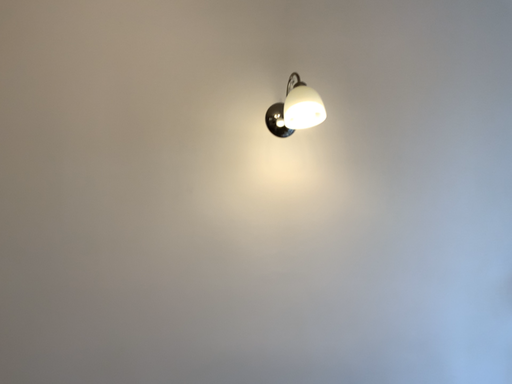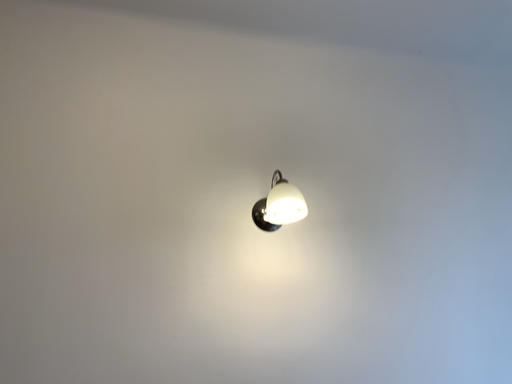
Question: Which way did the camera rotate in the video?

Choices:
 (A) rotated downward
 (B) rotated upward

Answer: (B)